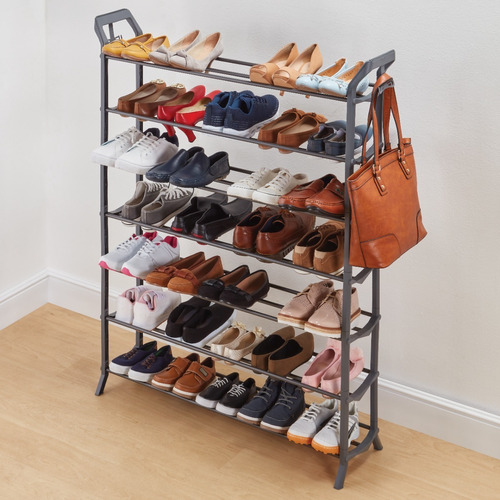
Locate an element on the screen. Image resolution: width=500 pixels, height=500 pixels. shoes on top shelf is located at coordinates (113, 47), (138, 54), (160, 54), (181, 61), (260, 69), (283, 74), (308, 81), (328, 85).